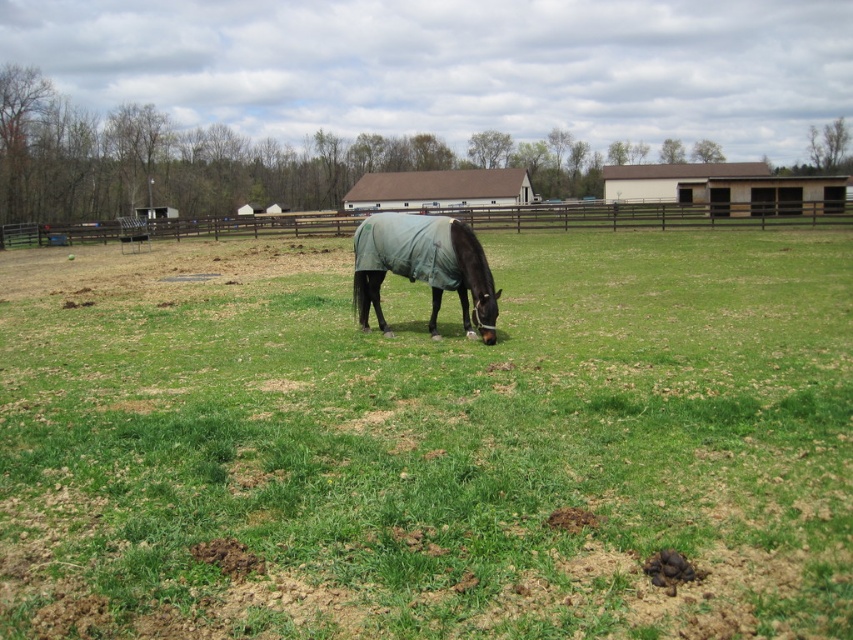
Is green matte horse at center to the right of dark green fabric horse at center from the viewer's perspective?

In fact, green matte horse at center is to the left of dark green fabric horse at center.

Who is more distant from viewer, (251, 456) or (397, 273)?

Positioned behind is point (397, 273).

I want to click on green matte horse at center, so click(428, 442).